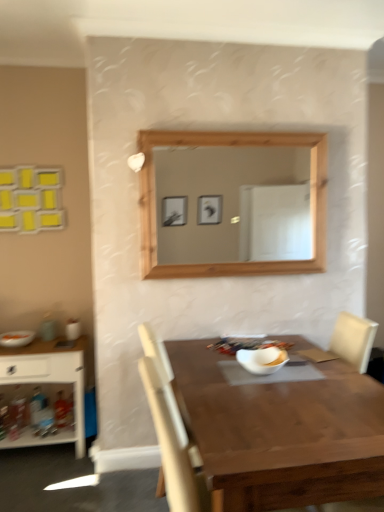
What do you see at coordinates (270, 356) in the screenshot? Image resolution: width=384 pixels, height=512 pixels. I see `white matte bowl at center, which appears as the second food when viewed from the back` at bounding box center [270, 356].

The image size is (384, 512). What do you see at coordinates (48, 383) in the screenshot?
I see `white wood shelf at left` at bounding box center [48, 383].

I want to click on white matte bowl at center, the first food when ordered from right to left, so click(270, 356).

Between white glossy bowl at center and wooden table at center, which one appears on the left side from the viewer's perspective?

Positioned to the left is white glossy bowl at center.

Considering the relative sizes of white glossy bowl at center and wooden table at center in the image provided, is white glossy bowl at center thinner than wooden table at center?

Correct, the width of white glossy bowl at center is less than that of wooden table at center.

Is wooden table at center inside white glossy bowl at center?

Definitely not — wooden table at center is not inside white glossy bowl at center.

Considering the points (242, 350) and (209, 437), which point is behind, point (242, 350) or point (209, 437)?

Positioned behind is point (242, 350).

Looking at this image, is white glossy bowl at center bigger or smaller than white matte bowl at center, which appears as the second food when viewed from the back?

Clearly, white glossy bowl at center is larger in size than white matte bowl at center, which appears as the second food when viewed from the back.

Is point (262, 359) closer or farther from the camera than point (283, 353)?

Point (262, 359) is positioned closer to the camera compared to point (283, 353).

Consider the image. From a real-world perspective, is white glossy bowl at center positioned above or below white matte bowl at center, marked as the second food in a left-to-right arrangement?

white glossy bowl at center is below white matte bowl at center, marked as the second food in a left-to-right arrangement.

Can you confirm if white glossy bowl at center is thinner than white matte bowl at center, which appears as the second food when viewed from the back?

No, white glossy bowl at center is not thinner than white matte bowl at center, which appears as the second food when viewed from the back.

From a real-world perspective, does wooden table at center sit lower than matte orange bowl at left, arranged as the second food when viewed from the right?

Yes, from a real-world perspective, wooden table at center is under matte orange bowl at left, arranged as the second food when viewed from the right.

Between wooden table at center and matte orange bowl at left, arranged as the second food when viewed from the right, which one has smaller size?

Smaller between the two is matte orange bowl at left, arranged as the second food when viewed from the right.

Are wooden table at center and matte orange bowl at left, arranged as the second food when viewed from the right, making contact?

No, wooden table at center is not making contact with matte orange bowl at left, arranged as the second food when viewed from the right.

How far apart are wooden table at center and matte orange bowl at left, arranged as the second food when viewed from the right?

5.74 feet.

Is wooden table at center at the right side of white wood shelf at left?

Yes, wooden table at center is to the right of white wood shelf at left.

Between point (204, 341) and point (75, 376), which one is positioned in front?

The point (204, 341) is in front.

Is wooden table at center inside or outside of white wood shelf at left?

wooden table at center is spatially situated outside white wood shelf at left.

In terms of width, does wooden table at center look wider or thinner when compared to white wood shelf at left?

Clearly, wooden table at center has more width compared to white wood shelf at left.

Is there a large distance between white wood shelf at left and white matte bowl at center, the first food when ordered from right to left?

Yes, white wood shelf at left is far from white matte bowl at center, the first food when ordered from right to left.

Considering the sizes of white wood shelf at left and white matte bowl at center, which is the 1th food in front-to-back order, in the image, is white wood shelf at left wider or thinner than white matte bowl at center, which is the 1th food in front-to-back order,?

Clearly, white wood shelf at left has more width compared to white matte bowl at center, which is the 1th food in front-to-back order.

What's the angular difference between white wood shelf at left and white matte bowl at center, the first food when ordered from right to left,'s facing directions?

0.208 degrees.

Which of these two, white wood shelf at left or white matte bowl at center, which is the 1th food in front-to-back order, is bigger?

With larger size is white wood shelf at left.

From the image's perspective, is white wood shelf at left on top of wooden table at center?

Yes.

Which object is positioned more to the right, white wood shelf at left or wooden table at center?

wooden table at center is more to the right.

Which point is more forward, (61, 362) or (274, 478)?

The point (274, 478) is more forward.

In the scene shown: Which object is wider, white wood shelf at left or wooden table at center?

With larger width is wooden table at center.

Is wooden table at center at the left side of white matte bowl at center, which is the 1th food in front-to-back order?

No, wooden table at center is not to the left of white matte bowl at center, which is the 1th food in front-to-back order.

Looking at this image, from the image's perspective, which one is positioned higher, wooden table at center or white matte bowl at center, which is the 1th food in front-to-back order?

white matte bowl at center, which is the 1th food in front-to-back order, is shown above in the image.

At what (x,y) coordinates should I click in order to perform the action: click on table in front of the white glossy bowl at center. Please return your answer as a coordinate pair (x, y). Looking at the image, I should click on (281, 433).

The image size is (384, 512). I want to click on bowl below the white matte bowl at center, marked as the second food in a left-to-right arrangement (from the image's perspective), so click(x=261, y=360).

Estimate the real-world distances between objects in this image. Which object is closer to matte orange bowl at left, which is counted as the first food, starting from the back, wooden table at center or white wood shelf at left?

white wood shelf at left lies closer to matte orange bowl at left, which is counted as the first food, starting from the back, than the other object.

Which object lies nearer to the anchor point white wood shelf at left, matte orange bowl at left, which is counted as the first food, starting from the back, or white matte bowl at center, marked as the second food in a left-to-right arrangement?

matte orange bowl at left, which is counted as the first food, starting from the back, is closer to white wood shelf at left.

Looking at the image, which one is located further to matte orange bowl at left, which appears as the first food when viewed from the left, white matte bowl at center, which is the 1th food in front-to-back order, or white wood shelf at left?

Among the two, white matte bowl at center, which is the 1th food in front-to-back order, is located further to matte orange bowl at left, which appears as the first food when viewed from the left.

Based on the photo, considering their positions, is white glossy bowl at center positioned closer to white wood shelf at left than wooden table at center?

white glossy bowl at center is positioned closer to the anchor white wood shelf at left.

Looking at the image, which one is located further to wooden table at center, white glossy bowl at center or matte orange bowl at left, the 2th food in the front-to-back sequence?

matte orange bowl at left, the 2th food in the front-to-back sequence, is positioned further to the anchor wooden table at center.

Looking at the image, which one is located closer to white matte bowl at center, marked as the second food in a left-to-right arrangement, matte orange bowl at left, which is counted as the first food, starting from the back, or white wood shelf at left?

The object closer to white matte bowl at center, marked as the second food in a left-to-right arrangement, is white wood shelf at left.

Looking at the image, which one is located further to matte orange bowl at left, which is counted as the first food, starting from the back, white matte bowl at center, which is the 1th food in front-to-back order, or white glossy bowl at center?

white matte bowl at center, which is the 1th food in front-to-back order, is further to matte orange bowl at left, which is counted as the first food, starting from the back.

Considering their positions, is wooden table at center positioned further to white matte bowl at center, the first food when ordered from right to left, than matte orange bowl at left, the 2th food in the front-to-back sequence?

The object further to white matte bowl at center, the first food when ordered from right to left, is matte orange bowl at left, the 2th food in the front-to-back sequence.

This screenshot has width=384, height=512. In order to click on bowl between matte orange bowl at left, which appears as the first food when viewed from the left, and wooden table at center in this screenshot , I will do `click(261, 360)`.

Identify the location of bowl between wooden table at center and white matte bowl at center, which appears as the second food when viewed from the back, from front to back. The height and width of the screenshot is (512, 384). (261, 360).

Identify the location of food situated between matte orange bowl at left, arranged as the second food when viewed from the right, and wooden table at center from left to right. (270, 356).

Locate an element on the screen. Image resolution: width=384 pixels, height=512 pixels. bowl between white wood shelf at left and white matte bowl at center, marked as the second food in a left-to-right arrangement, in the horizontal direction is located at coordinates (261, 360).